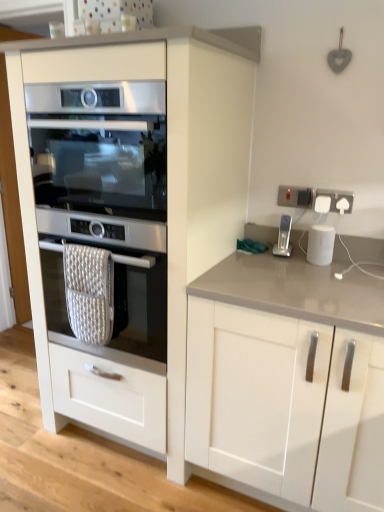
The height and width of the screenshot is (512, 384). I want to click on white glossy smart speaker at right, so click(x=320, y=245).

The height and width of the screenshot is (512, 384). What do you see at coordinates (285, 406) in the screenshot? I see `white glossy cabinet at lower right, the second cabinetry in the left-to-right sequence` at bounding box center [285, 406].

Measure the distance between point (238, 210) and camera.

Point (238, 210) is 5.88 feet away from camera.

Where is `white plastic socket at upper right, marked as the first electric outlet in a right-to-left arrangement`? white plastic socket at upper right, marked as the first electric outlet in a right-to-left arrangement is located at coordinates (333, 201).

Measure the distance between white plastic socket at upper right, marked as the first electric outlet in a right-to-left arrangement, and camera.

white plastic socket at upper right, marked as the first electric outlet in a right-to-left arrangement, and camera are 1.72 meters apart from each other.

The image size is (384, 512). I want to click on white plastic socket at upper right, which is the second electric outlet from right to left, so coord(295,196).

What do you see at coordinates (114, 280) in the screenshot? I see `satin silver oven at center, which is the first oven from bottom to top` at bounding box center [114, 280].

You are a GUI agent. You are given a task and a screenshot of the screen. Output one action in this format:
    pyautogui.click(x=<x>, y=<y>)
    Task: Click on the white glossy smart speaker at right
    
    Given the screenshot: What is the action you would take?
    pyautogui.click(x=320, y=245)

Is white glossy cabinet at lower right, marked as the 1th cabinetry in a right-to-left arrangement, bigger than satin silver oven at center, marked as the 2th oven in a top-to-bottom arrangement?

Yes.

Based on the photo, is white glossy cabinet at lower right, marked as the 1th cabinetry in a right-to-left arrangement, at the right side of satin silver oven at center, which is the first oven from bottom to top?

Yes.

Looking at this image, does white glossy cabinet at lower right, the second cabinetry in the left-to-right sequence, lie in front of satin silver oven at center, which is the first oven from bottom to top?

That is True.

You are a GUI agent. You are given a task and a screenshot of the screen. Output one action in this format:
    pyautogui.click(x=<x>, y=<y>)
    Task: Click on the 2nd oven to the left of the white glossy cabinet at lower right, the second cabinetry in the left-to-right sequence, starting your count from the anchor
    
    Given the screenshot: What is the action you would take?
    pyautogui.click(x=114, y=280)

Would you say white plastic socket at upper right, which is the second electric outlet from right to left, contains satin silver oven at center, which is the first oven from bottom to top?

No, satin silver oven at center, which is the first oven from bottom to top, is not inside white plastic socket at upper right, which is the second electric outlet from right to left.

Consider the image. From the image's perspective, does white plastic socket at upper right, the 1th electric outlet viewed from the left, appear lower than satin silver oven at center, marked as the 2th oven in a top-to-bottom arrangement?

Incorrect, from the image's perspective, white plastic socket at upper right, the 1th electric outlet viewed from the left, is higher than satin silver oven at center, marked as the 2th oven in a top-to-bottom arrangement.

Is white plastic socket at upper right, which is the second electric outlet from right to left, facing away from satin silver oven at center, marked as the 2th oven in a top-to-bottom arrangement?

That's not correct — white plastic socket at upper right, which is the second electric outlet from right to left, is not looking away from satin silver oven at center, marked as the 2th oven in a top-to-bottom arrangement.

Considering the sizes of objects white plastic socket at upper right, the 1th electric outlet viewed from the left, and satin silver oven at center, which is the first oven from bottom to top, in the image provided, who is bigger, white plastic socket at upper right, the 1th electric outlet viewed from the left, or satin silver oven at center, which is the first oven from bottom to top,?

satin silver oven at center, which is the first oven from bottom to top.

In terms of height, does white glossy smart speaker at right look taller or shorter compared to satin silver oven at center, the first oven viewed from the top?

white glossy smart speaker at right is shorter than satin silver oven at center, the first oven viewed from the top.

From the image's perspective, which one is positioned higher, white glossy smart speaker at right or satin silver oven at center, the first oven viewed from the top?

satin silver oven at center, the first oven viewed from the top, is shown above in the image.

Is white glossy smart speaker at right facing away from satin silver oven at center, the second oven from the bottom?

white glossy smart speaker at right is not turned away from satin silver oven at center, the second oven from the bottom.

Is satin silver oven at center, the second oven from the bottom, at the back of white plastic socket at upper right, which is the second electric outlet from right to left?

That's not correct — white plastic socket at upper right, which is the second electric outlet from right to left, is not looking away from satin silver oven at center, the second oven from the bottom.

From a real-world perspective, is white plastic socket at upper right, the 1th electric outlet viewed from the left, above or below satin silver oven at center, the second oven from the bottom?

Clearly, from a real-world perspective, white plastic socket at upper right, the 1th electric outlet viewed from the left, is below satin silver oven at center, the second oven from the bottom.

Considering the points (305, 189) and (158, 139), which point is behind, point (305, 189) or point (158, 139)?

Positioned behind is point (305, 189).

Image resolution: width=384 pixels, height=512 pixels. I want to click on home appliance that is on the left side of white glossy smart speaker at right, so click(x=283, y=237).

Can you confirm if silver metallic stapler at right is bigger than white glossy smart speaker at right?

No, silver metallic stapler at right is not bigger than white glossy smart speaker at right.

Is white glossy smart speaker at right a part of silver metallic stapler at right?

Definitely not — white glossy smart speaker at right is not inside silver metallic stapler at right.

How much distance is there between white glossy cabinet at lower right, marked as the 1th cabinetry in a right-to-left arrangement, and satin silver oven at center, the first oven viewed from the top?

They are 28.05 inches apart.

From the picture: Are white glossy cabinet at lower right, marked as the 1th cabinetry in a right-to-left arrangement, and satin silver oven at center, the second oven from the bottom, beside each other?

They are not placed beside each other.

Who is bigger, white glossy cabinet at lower right, the second cabinetry in the left-to-right sequence, or satin silver oven at center, the second oven from the bottom?

Bigger between the two is white glossy cabinet at lower right, the second cabinetry in the left-to-right sequence.

Looking at this image, is satin silver oven at center, the second oven from the bottom, surrounded by white glossy cabinet at lower right, the second cabinetry in the left-to-right sequence?

No, satin silver oven at center, the second oven from the bottom, is not surrounded by white glossy cabinet at lower right, the second cabinetry in the left-to-right sequence.

Is satin silver oven at center, marked as the 2th oven in a top-to-bottom arrangement, positioned behind white glossy cabinet at left, which ranks as the first cabinetry in left-to-right order?

Yes, satin silver oven at center, marked as the 2th oven in a top-to-bottom arrangement, is further from the camera.

Which of these two, satin silver oven at center, marked as the 2th oven in a top-to-bottom arrangement, or white glossy cabinet at left, which ranks as the first cabinetry in left-to-right order, is thinner?

white glossy cabinet at left, which ranks as the first cabinetry in left-to-right order, is thinner.

Which of these two, satin silver oven at center, marked as the 2th oven in a top-to-bottom arrangement, or white glossy cabinet at left, which ranks as the first cabinetry in left-to-right order, is bigger?

white glossy cabinet at left, which ranks as the first cabinetry in left-to-right order.

From the image's perspective, which is below, satin silver oven at center, which is the first oven from bottom to top, or white glossy cabinet at left, positioned as the 2th cabinetry in right-to-left order?

satin silver oven at center, which is the first oven from bottom to top, from the image's perspective.

Image resolution: width=384 pixels, height=512 pixels. Find the location of `the 1st oven positioned above the white glossy cabinet at lower right, the second cabinetry in the left-to-right sequence (from the image's perspective)`. the 1st oven positioned above the white glossy cabinet at lower right, the second cabinetry in the left-to-right sequence (from the image's perspective) is located at coordinates (114, 280).

The width and height of the screenshot is (384, 512). I want to click on the 1st oven in front of the white plastic socket at upper right, which is the second electric outlet from right to left, starting your count from the anchor, so click(114, 280).

Looking at the image, which one is located further to white plastic socket at upper right, which is the second electric outlet from right to left, white glossy cabinet at lower right, marked as the 1th cabinetry in a right-to-left arrangement, or white glossy smart speaker at right?

Based on the image, white glossy cabinet at lower right, marked as the 1th cabinetry in a right-to-left arrangement, appears to be further to white plastic socket at upper right, which is the second electric outlet from right to left.

Estimate the real-world distances between objects in this image. Which object is further from satin silver oven at center, which is the first oven from bottom to top, silver metallic stapler at right or white glossy cabinet at lower right, marked as the 1th cabinetry in a right-to-left arrangement?

silver metallic stapler at right is positioned further to the anchor satin silver oven at center, which is the first oven from bottom to top.

Based on their spatial positions, is white glossy cabinet at lower right, marked as the 1th cabinetry in a right-to-left arrangement, or silver metallic stapler at right further from white glossy smart speaker at right?

white glossy cabinet at lower right, marked as the 1th cabinetry in a right-to-left arrangement, lies further to white glossy smart speaker at right than the other object.

Estimate the real-world distances between objects in this image. Which object is further from white glossy cabinet at lower right, the second cabinetry in the left-to-right sequence, white glossy smart speaker at right or white glossy cabinet at left, positioned as the 2th cabinetry in right-to-left order?

white glossy smart speaker at right is further to white glossy cabinet at lower right, the second cabinetry in the left-to-right sequence.

When comparing their distances from silver metallic stapler at right, does satin silver oven at center, which is the first oven from bottom to top, or white plastic socket at upper right, the 1th electric outlet viewed from the left, seem closer?

white plastic socket at upper right, the 1th electric outlet viewed from the left, lies closer to silver metallic stapler at right than the other object.

Looking at the image, which one is located further to satin silver oven at center, which is the first oven from bottom to top, white plastic socket at upper right, marked as the first electric outlet in a right-to-left arrangement, or silver metallic stapler at right?

white plastic socket at upper right, marked as the first electric outlet in a right-to-left arrangement, lies further to satin silver oven at center, which is the first oven from bottom to top, than the other object.

Based on their spatial positions, is white plastic socket at upper right, which is the second electric outlet from right to left, or satin silver oven at center, the first oven viewed from the top, further from silver metallic stapler at right?

satin silver oven at center, the first oven viewed from the top, lies further to silver metallic stapler at right than the other object.

From the picture: Based on their spatial positions, is silver metallic stapler at right or satin silver oven at center, marked as the 2th oven in a top-to-bottom arrangement, closer to white plastic socket at upper right, marked as the first electric outlet in a right-to-left arrangement?

silver metallic stapler at right is positioned closer to the anchor white plastic socket at upper right, marked as the first electric outlet in a right-to-left arrangement.

Where is `cabinetry between white glossy cabinet at left, positioned as the 2th cabinetry in right-to-left order, and white glossy smart speaker at right, in the horizontal direction`? The width and height of the screenshot is (384, 512). cabinetry between white glossy cabinet at left, positioned as the 2th cabinetry in right-to-left order, and white glossy smart speaker at right, in the horizontal direction is located at coordinates (285, 406).

Find the location of a particular element. The width and height of the screenshot is (384, 512). kitchen appliance located between silver metallic stapler at right and white plastic socket at upper right, which is the 2th electric outlet from left to right, in the left-right direction is located at coordinates (320, 245).

Locate an element on the screen. The height and width of the screenshot is (512, 384). kitchen appliance situated between satin silver oven at center, the first oven viewed from the top, and white plastic socket at upper right, which is the 2th electric outlet from left to right, from left to right is located at coordinates (320, 245).

Where is `cabinetry located between satin silver oven at center, which is the first oven from bottom to top, and silver metallic stapler at right in the left-right direction`? cabinetry located between satin silver oven at center, which is the first oven from bottom to top, and silver metallic stapler at right in the left-right direction is located at coordinates (168, 170).